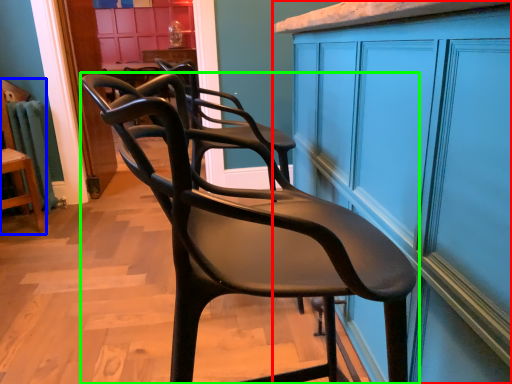
Question: Based on their relative distances, which object is nearer to cabinetry (highlighted by a red box)? Choose from chair (highlighted by a blue box) and chair (highlighted by a green box).

Choices:
 (A) chair
 (B) chair

Answer: (B)